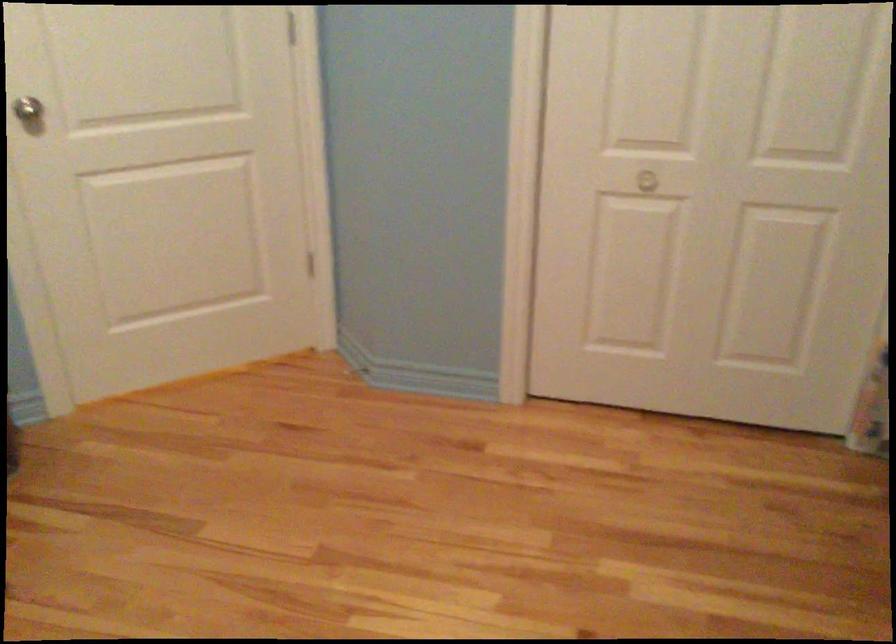
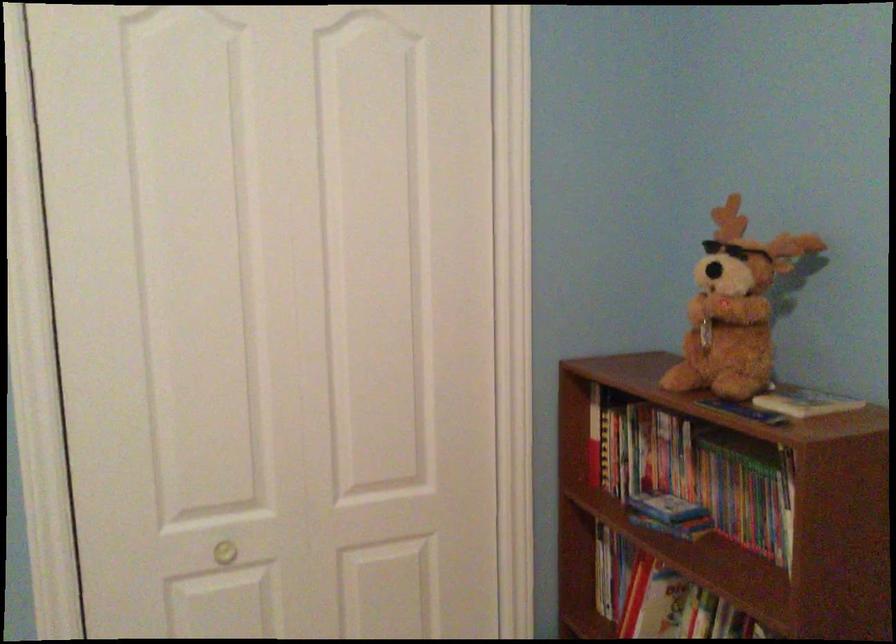
Question: The first image is from the beginning of the video and the second image is from the end. How did the camera likely rotate when shooting the video?

Choices:
 (A) Left
 (B) Right
 (C) Up
 (D) Down

Answer: (B)